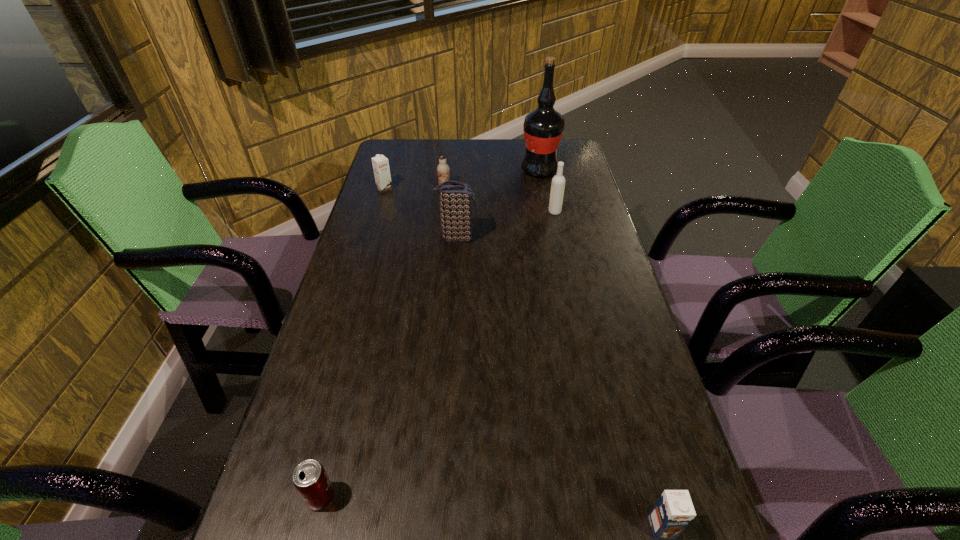
Locate an element on the screen. The width and height of the screenshot is (960, 540). free spot located 0.300m with the zip open on the third nearest object is located at coordinates (577, 238).

Where is `vacant space located 0.280m on the front of the vodka`? The width and height of the screenshot is (960, 540). vacant space located 0.280m on the front of the vodka is located at coordinates (568, 276).

Find the location of a particular element. blank area located on the front of the leftmost chocolate milk is located at coordinates (368, 247).

The image size is (960, 540). In order to click on vacant space located on the front of the second chocolate milk from right to left in this screenshot , I will do `click(442, 208)`.

Where is `vacant point located 0.260m on the back of the second nearest object`? vacant point located 0.260m on the back of the second nearest object is located at coordinates (354, 364).

This screenshot has width=960, height=540. Identify the location of object positioned at the far edge. (543, 127).

Locate an element on the screen. This screenshot has width=960, height=540. chocolate milk that is at the left edge is located at coordinates (380, 163).

Identify the location of beer can situated at the left edge. click(x=310, y=479).

Identify the location of wine bottle that is at the right edge. Image resolution: width=960 pixels, height=540 pixels. (543, 127).

The width and height of the screenshot is (960, 540). I want to click on vodka that is positioned at the right edge, so click(558, 182).